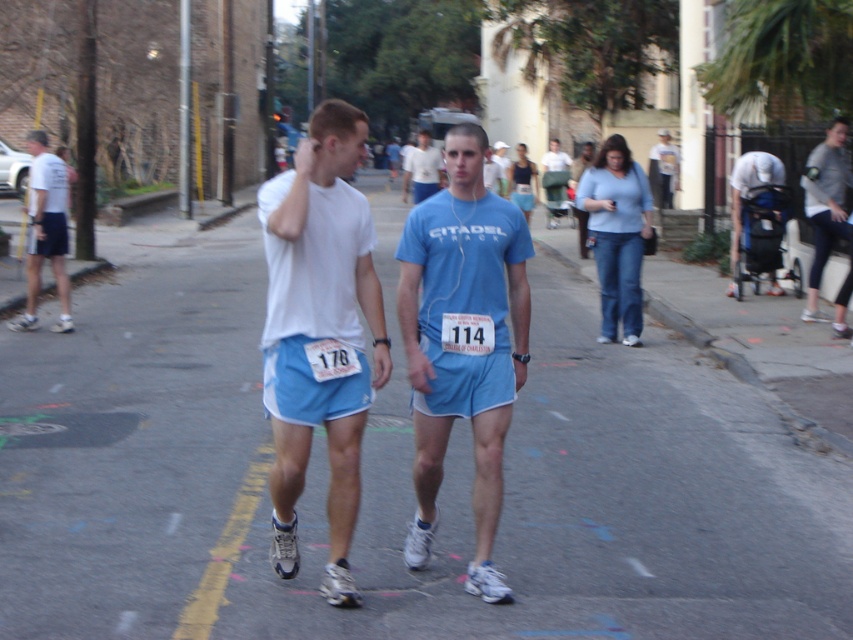
Question: Based on their relative distances, which object is farther from the light blue t-shirt at center?

Choices:
 (A) light blue denim shorts at center
 (B) white matte shorts at center
 (C) gray fabric jacket at upper right

Answer: (B)

Question: Is light blue denim shorts at center closer to camera compared to light blue t-shirt at center?

Choices:
 (A) yes
 (B) no

Answer: (A)

Question: Which point appears farthest from the camera in this image?

Choices:
 (A) (544, 179)
 (B) (827, 164)
 (C) (434, 173)
 (D) (41, 170)

Answer: (A)

Question: Is white matte shorts at center thinner than matte white t-shirt at left?

Choices:
 (A) no
 (B) yes

Answer: (B)

Question: Is white matte shorts at center to the left of matte white t-shirt at left from the viewer's perspective?

Choices:
 (A) no
 (B) yes

Answer: (A)

Question: Based on their relative distances, which object is farther from the light blue fabric shorts at center?

Choices:
 (A) blue fabric stroller at right
 (B) matte white shirt at center
 (C) matte blue shorts at center

Answer: (C)